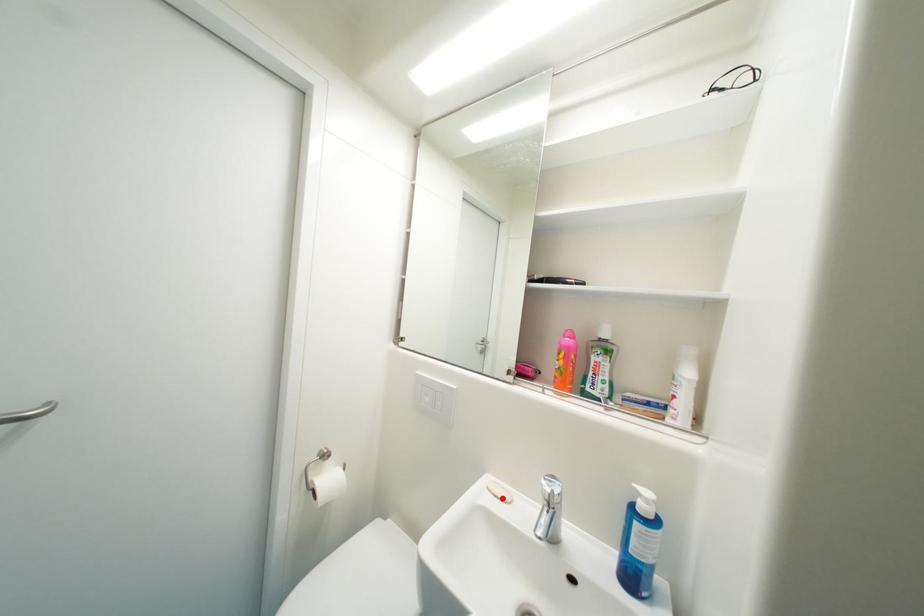
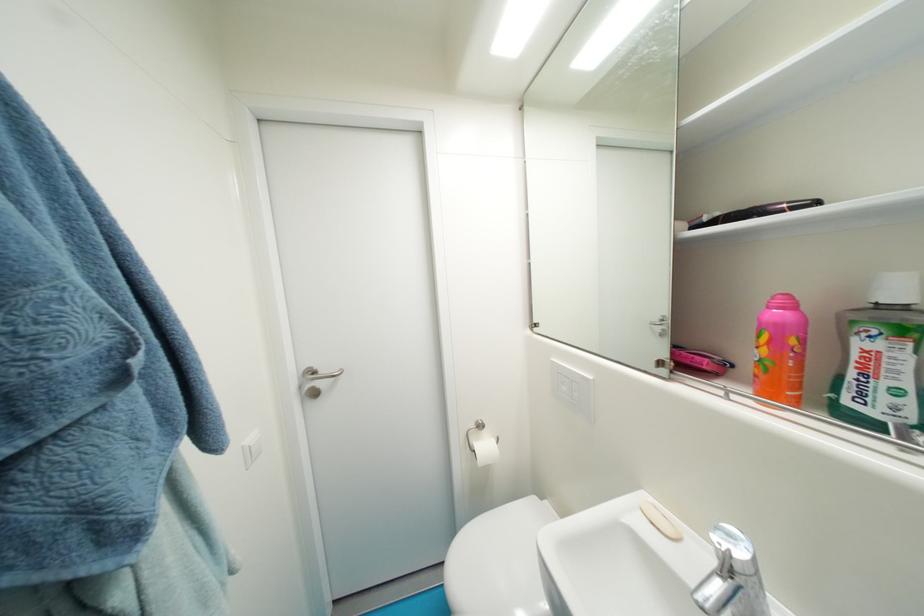
Find the pixel in the second image that matches the highlighted location in the first image.

(659, 525)